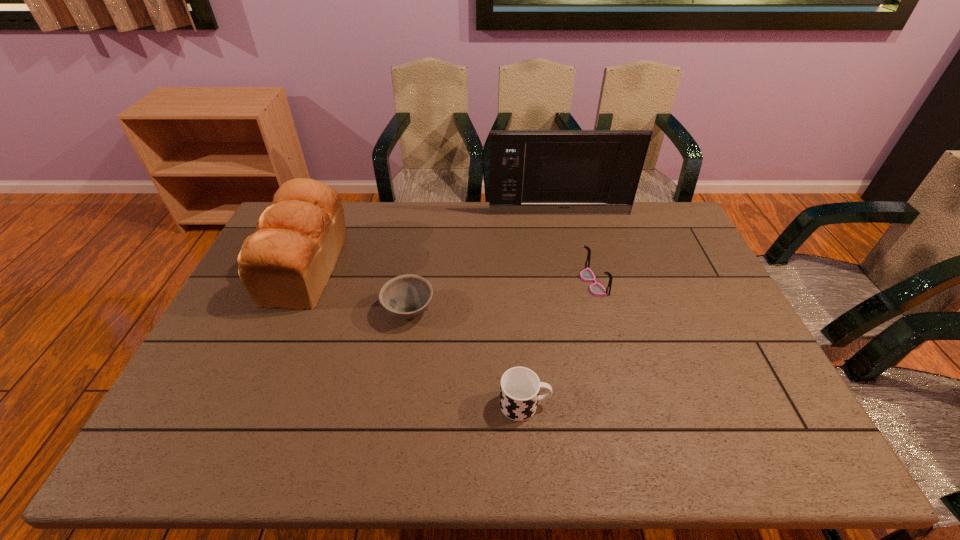
Locate an element on the screen. The height and width of the screenshot is (540, 960). free region at the right edge is located at coordinates (715, 374).

The image size is (960, 540). I want to click on free region at the near left corner, so pos(180,427).

Locate an element on the screen. The height and width of the screenshot is (540, 960). vacant space that's between the third tallest object and the nearest object is located at coordinates (559, 344).

You are a GUI agent. You are given a task and a screenshot of the screen. Output one action in this format:
    pyautogui.click(x=<x>, y=<y>)
    Task: Click on the empty space between the bowl and the leftmost object
    
    Given the screenshot: What is the action you would take?
    pyautogui.click(x=358, y=289)

Image resolution: width=960 pixels, height=540 pixels. I want to click on empty location between the second object from left to right and the fourth shortest object, so click(x=358, y=289).

Where is `vacant space in between the spectacles and the farthest object`? This screenshot has width=960, height=540. vacant space in between the spectacles and the farthest object is located at coordinates (576, 248).

Locate an element on the screen. Image resolution: width=960 pixels, height=540 pixels. empty space that is in between the second tallest object and the fourth object from right to left is located at coordinates (358, 289).

The image size is (960, 540). What are the coordinates of `vacant space that is in between the microwave oven and the bread` in the screenshot? It's located at (433, 241).

Locate an element on the screen. vacant region between the spectacles and the tallest object is located at coordinates (576, 248).

Image resolution: width=960 pixels, height=540 pixels. I want to click on free spot between the fourth object from right to left and the fourth shortest object, so click(x=358, y=289).